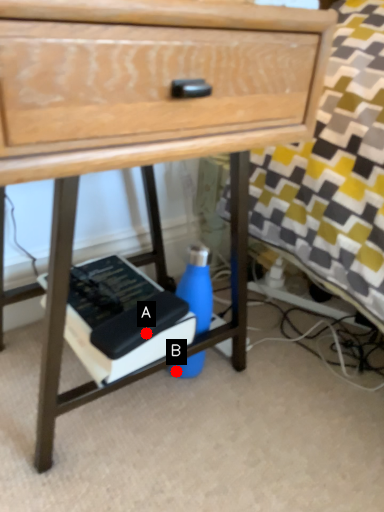
Question: Two points are circled on the image, labeled by A and B beside each circle. Which point appears closest to the camera in this image?

Choices:
 (A) A is closer
 (B) B is closer

Answer: (A)